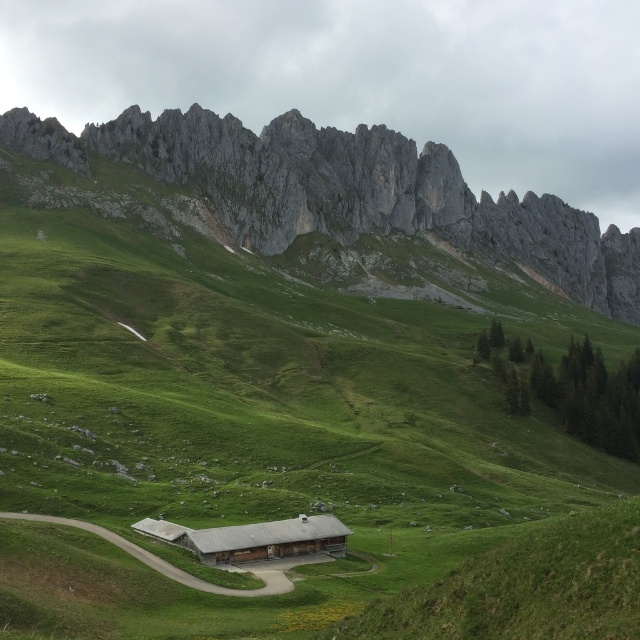
Looking at this image, is green grassy at center positioned in front of rugged stone mountain at upper center?

Yes, green grassy at center is closer to the viewer.

Does green grassy at center appear under rugged stone mountain at upper center?

Correct, green grassy at center is located below rugged stone mountain at upper center.

Describe the element at coordinates (280, 451) in the screenshot. This screenshot has height=640, width=640. I see `green grassy at center` at that location.

Find the location of `green grassy at center`. green grassy at center is located at coordinates (280, 451).

You are a GUI agent. You are given a task and a screenshot of the screen. Output one action in this format:
    pyautogui.click(x=<x>, y=<y>)
    Task: Click on the green grassy at center
    
    Given the screenshot: What is the action you would take?
    pyautogui.click(x=280, y=451)

Which is behind, point (58, 596) or point (218, 552)?

Positioned behind is point (218, 552).

Who is more forward, (60, 330) or (317, 534)?

Point (317, 534) is more forward.

At what (x,y) coordinates should I click in order to perform the action: click on green grassy at center. Please return your answer as a coordinate pair (x, y). This screenshot has width=640, height=640. Looking at the image, I should click on (280, 451).

Can you confirm if rugged stone mountain at upper center is positioned below brown wooden barn at center?

Incorrect, rugged stone mountain at upper center is not positioned below brown wooden barn at center.

Does rugged stone mountain at upper center appear on the left side of brown wooden barn at center?

Incorrect, rugged stone mountain at upper center is not on the left side of brown wooden barn at center.

This screenshot has height=640, width=640. In order to click on rugged stone mountain at upper center in this screenshot , I will do `click(346, 192)`.